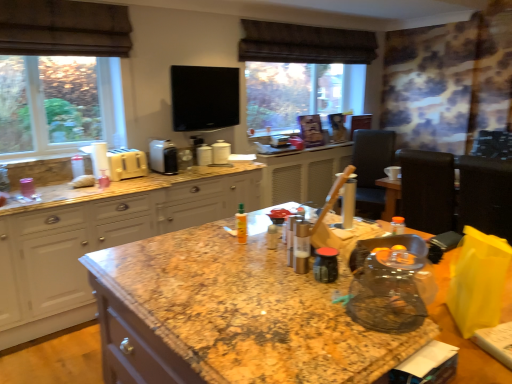
Identify the location of free space to the right of bread dough at left. The image size is (512, 384). (110, 184).